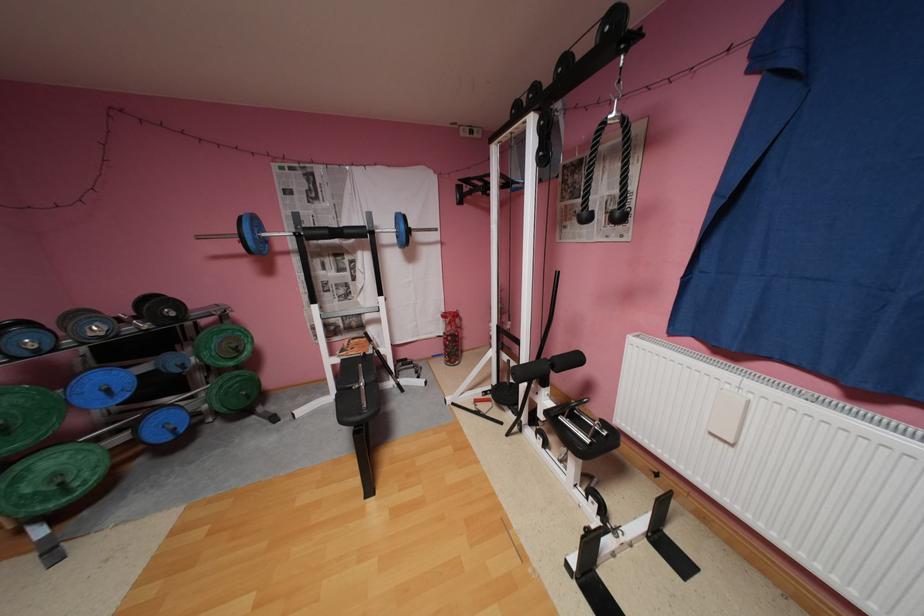
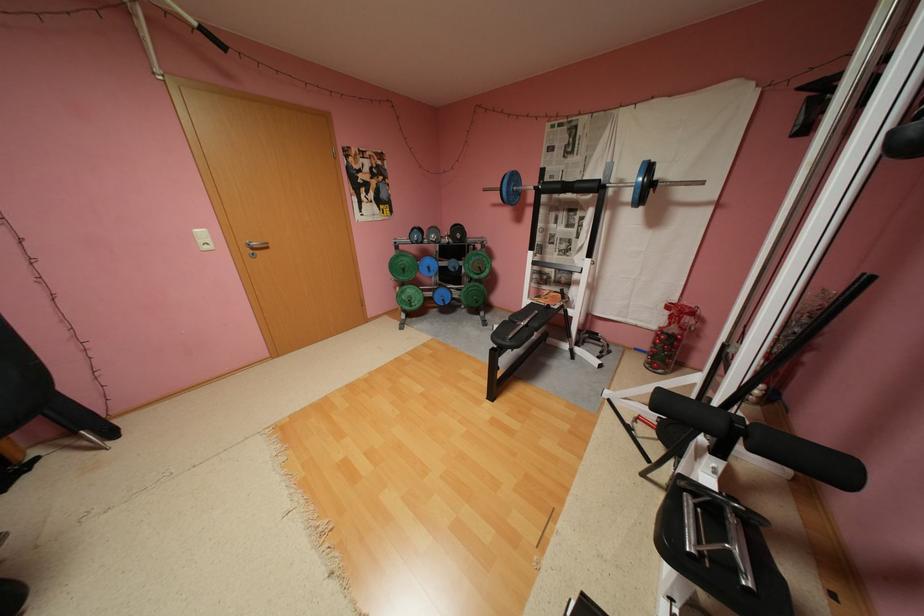
Locate, in the second image, the point that corresponds to pixel 263 238 in the first image.

(517, 191)